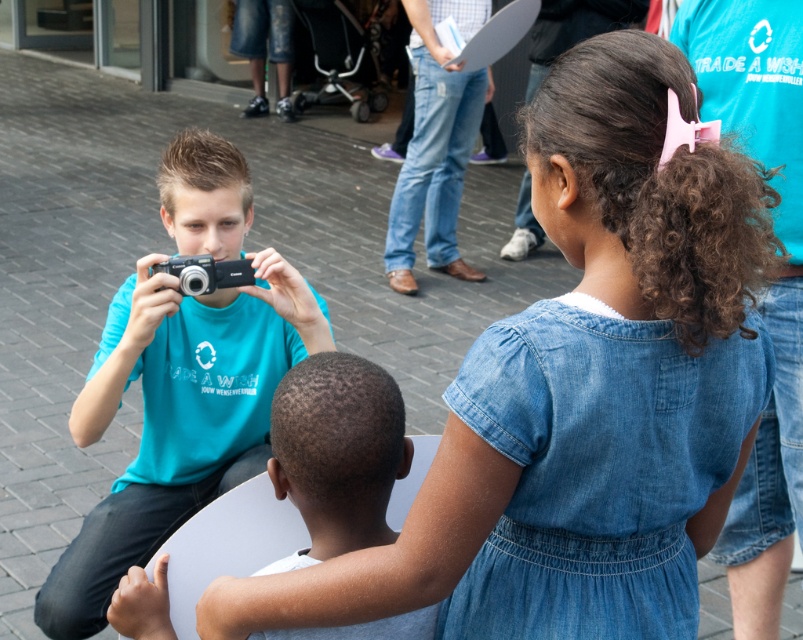
Question: Among these objects, which one is nearest to the camera?

Choices:
 (A) denim dress at center
 (B) black plastic camera at center
 (C) matte black camera at left
 (D) matte black camera at center

Answer: (A)

Question: Does denim dress at center appear on the right side of matte black camera at center?

Choices:
 (A) yes
 (B) no

Answer: (A)

Question: Can you confirm if matte black camera at left is positioned below black plastic camera at center?

Choices:
 (A) yes
 (B) no

Answer: (A)

Question: Is denim dress at center bigger than matte black camera at left?

Choices:
 (A) no
 (B) yes

Answer: (A)

Question: Estimate the real-world distances between objects in this image. Which object is farther from the blue jeans at center?

Choices:
 (A) black plastic camera at center
 (B) matte black camera at left
 (C) matte black camera at center

Answer: (C)

Question: Which point is closer to the camera?

Choices:
 (A) (188, 394)
 (B) (590, 147)

Answer: (B)